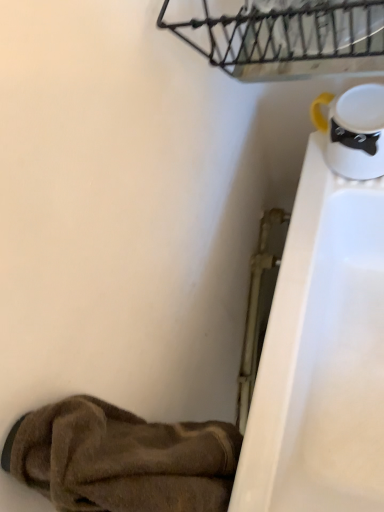
Question: Is brown fuzzy slipper at lower left inside the boundaries of rustic metal basket at upper center, or outside?

Choices:
 (A) outside
 (B) inside

Answer: (A)

Question: Is brown fuzzy slipper at lower left in front of or behind rustic metal basket at upper center in the image?

Choices:
 (A) front
 (B) behind

Answer: (A)

Question: In terms of size, does brown fuzzy slipper at lower left appear bigger or smaller than rustic metal basket at upper center?

Choices:
 (A) small
 (B) big

Answer: (B)

Question: From the image's perspective, is rustic metal basket at upper center above or below brown fuzzy slipper at lower left?

Choices:
 (A) below
 (B) above

Answer: (B)

Question: In terms of width, does rustic metal basket at upper center look wider or thinner when compared to brown fuzzy slipper at lower left?

Choices:
 (A) wide
 (B) thin

Answer: (A)

Question: In terms of height, does rustic metal basket at upper center look taller or shorter compared to brown fuzzy slipper at lower left?

Choices:
 (A) short
 (B) tall

Answer: (A)

Question: In terms of size, does rustic metal basket at upper center appear bigger or smaller than brown fuzzy slipper at lower left?

Choices:
 (A) small
 (B) big

Answer: (A)